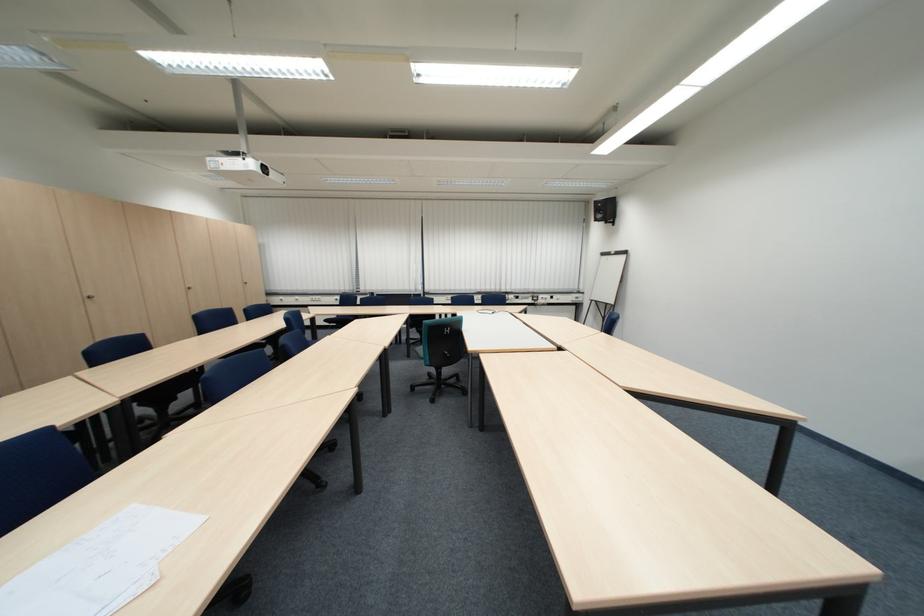
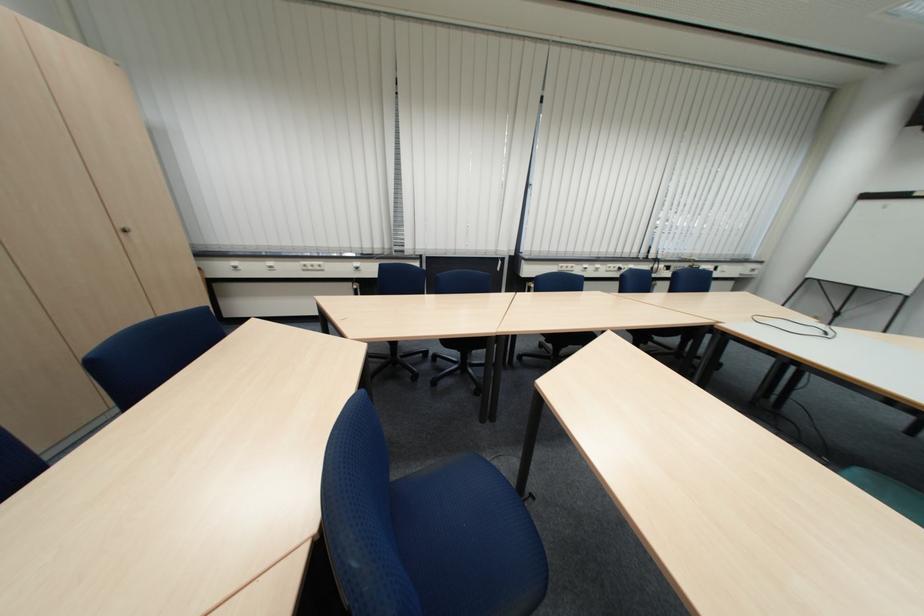
What movement of the cameraman would produce the second image?

The movement direction of the cameraman is left, forward.